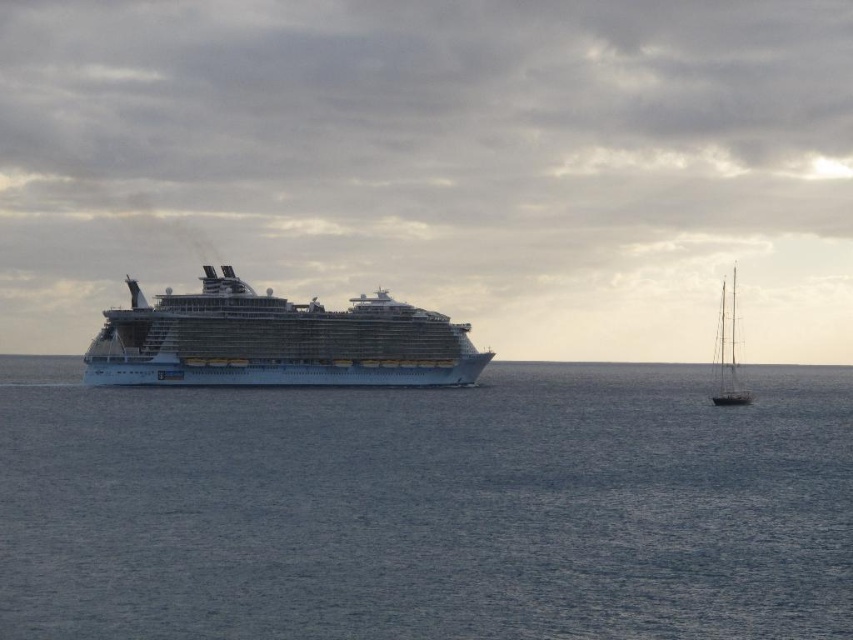
You are standing on the deck of the cruise ship and want to reach the point marked at coordinates (791, 604). If your walking speed is 1.5 meters per second, how many seconds will it take you to reach that point?

The distance between you and the point marked at coordinates (791, 604) is 49.75 meters. At a walking speed of 1.5 meters per second, it would take approximately 33.17 seconds to reach the point. This is calculated by dividing the distance by the speed.

You are a marine biologist studying vessel distances. You have a drone that can fly 50 meters. You need to measure the distance between the white glossy cruise ship at center and the wooden sailboat at right. Will your drone be able to reach both vessels from your current position?

The white glossy cruise ship at center and wooden sailboat at right are 43.16 meters apart from each other. Since your drone can fly 50 meters, it can easily cover the distance between them, so yes, the drone can reach both vessels from your current position.